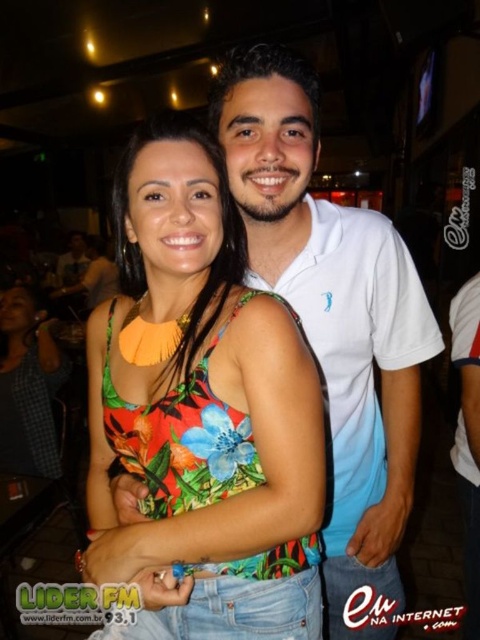
You are standing in a dimly lit bar and see two points of light in the scene. The first point is at coordinate point (117, 356) and the second is at point (367, 636). Which point is closer to you?

Point (117, 356) is closer to the viewer than point (367, 636).

You are standing in a bar and see the floral fabric top at center. Can you estimate its exact location in the image using coordinates?

The floral fabric top at center is located at coordinates point (203, 406).

You are at a party and want to take a photo of both the floral fabric top at center and the white cotton polo shirt at center. Which one should you focus on first if you want to capture them both in the frame?

Since the floral fabric top at center is to the left of the white cotton polo shirt at center, you should focus on the floral fabric top at center first to ensure both are in the frame.